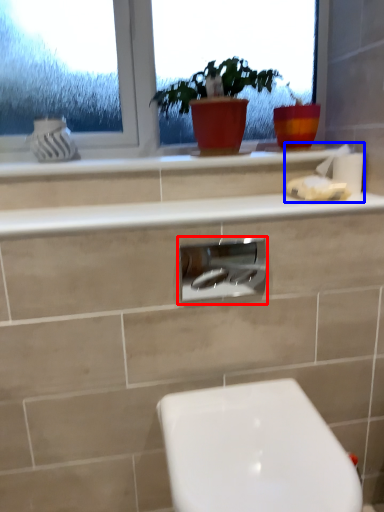
Question: Among these objects, which one is nearest to the camera, cabinet (highlighted by a red box) or tissue (highlighted by a blue box)?

Choices:
 (A) cabinet
 (B) tissue

Answer: (A)